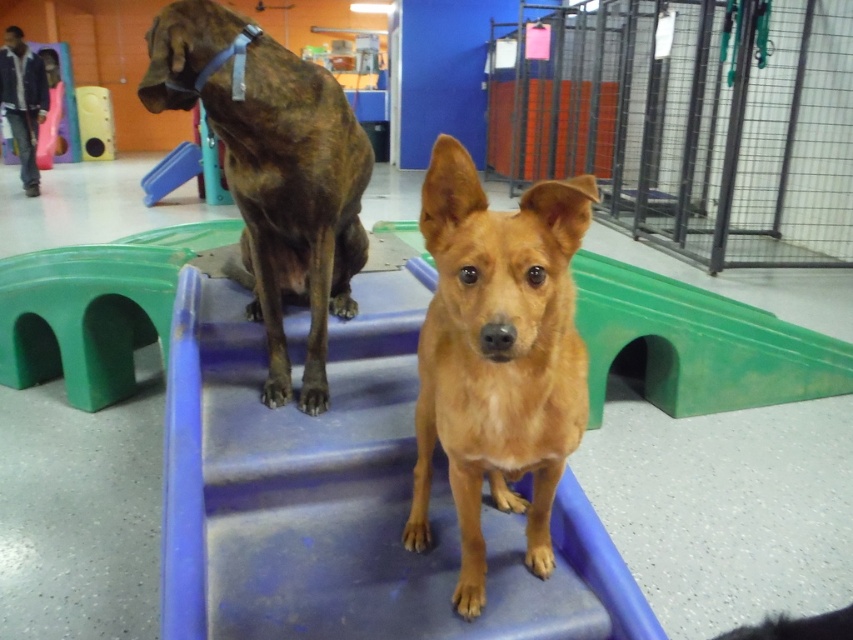
You are a dog trainer trying to set up an obstacle course. You need to place a new obstacle between the blue plastic stairs at center and the green tunnel where the brindle dog is standing. Based on their positions, can you determine if there is enough space to fit another obstacle between them?

The blue plastic stairs at center is located at point (343, 502), but without knowing the exact position of the green tunnel, it is impossible to determine the distance between them. Therefore, you cannot be certain if there is enough space to fit another obstacle between them.

You are a dog trainer observing the blue plastic stairs at center and the blue plastic slide at upper center in the training area. Which of these two objects is positioned closer to your current viewpoint?

The blue plastic stairs at center is closer to the viewer than the blue plastic slide at upper center.

You are a dog trainer observing the scene. You notice two points marked in the image. The first point is at coordinates point (744, 160) and the second point is at point (146, 40). Which point is closer to the camera?

Point (146, 40) is closer to the camera because point (744, 160) is behind it.